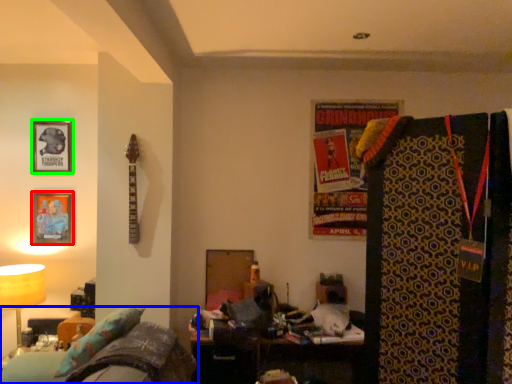
Question: Estimate the real-world distances between objects in this image. Which object is farther from picture frame (highlighted by a red box), furniture (highlighted by a blue box) or picture frame (highlighted by a green box)?

Choices:
 (A) furniture
 (B) picture frame

Answer: (A)